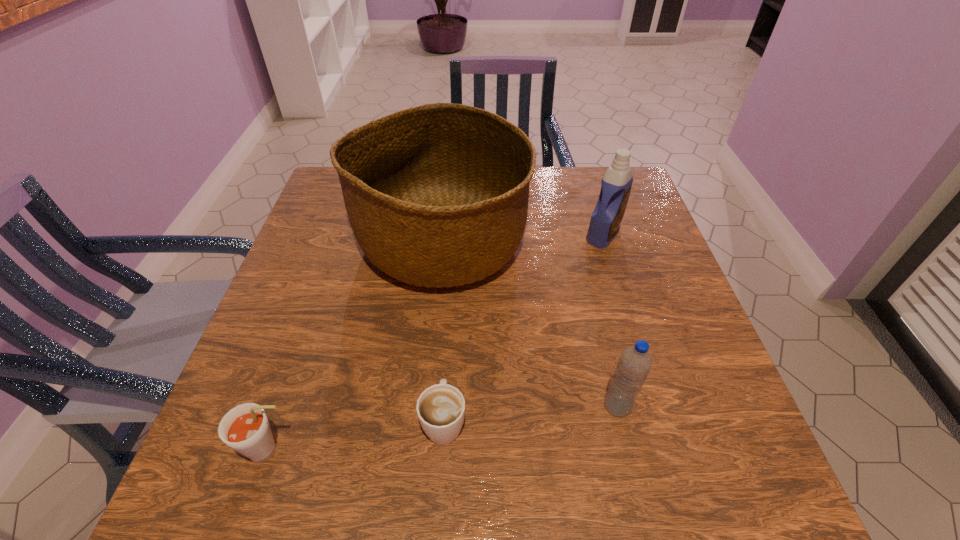
Locate an element on the screen. Image resolution: width=960 pixels, height=540 pixels. basket is located at coordinates (437, 195).

Where is `the fourth shortest object`? the fourth shortest object is located at coordinates (616, 184).

The width and height of the screenshot is (960, 540). Find the location of `the third tallest object`. the third tallest object is located at coordinates (635, 362).

The image size is (960, 540). Identify the location of the fourth tallest object. (245, 428).

The image size is (960, 540). I want to click on the shortest object, so click(x=441, y=408).

At what (x,y) coordinates should I click in order to perform the action: click on vacant position located 0.190m on the front of the basket. Please return your answer as a coordinate pair (x, y). Looking at the image, I should click on (428, 384).

Identify the location of free region located 0.150m on the back of the detergent. (589, 190).

Identify the location of vacant space located 0.110m on the right of the third tallest object. [689, 406].

Where is `vacant space located on the drink side of the root beer`? vacant space located on the drink side of the root beer is located at coordinates (353, 450).

Identify the location of vacant space located with the handle on the side of the shortest object. click(x=452, y=295).